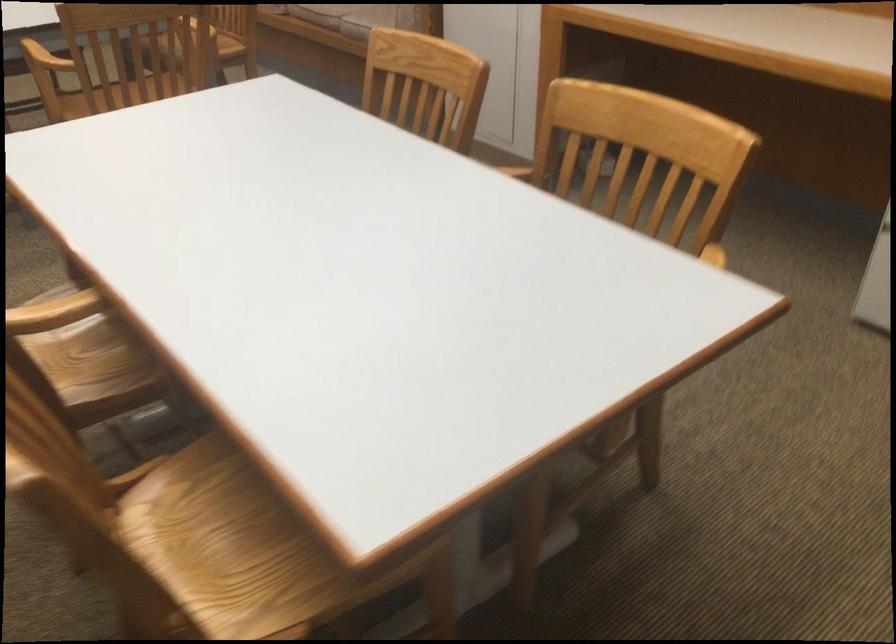
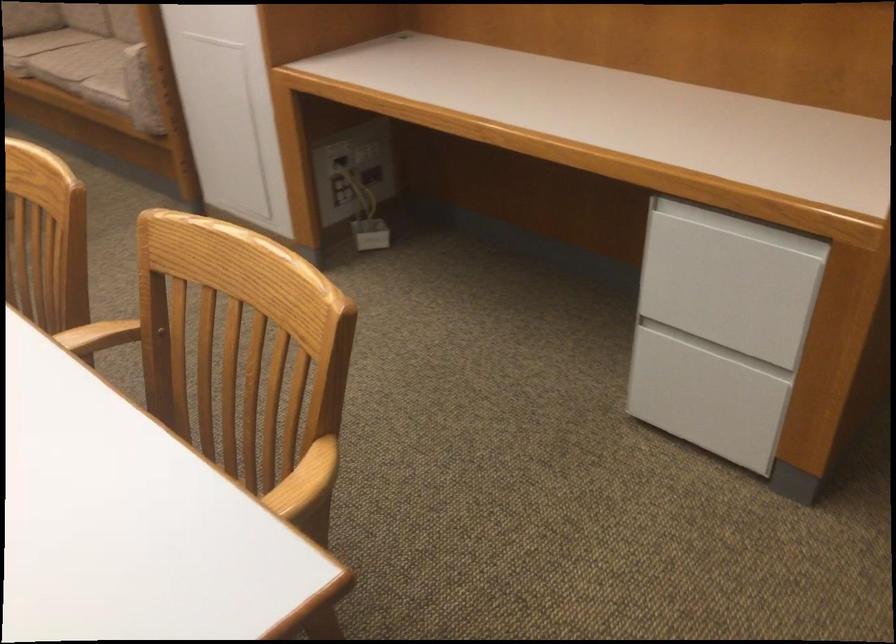
Question: The camera is either moving clockwise (left) or counter-clockwise (right) around the object. The first image is from the beginning of the video and the second image is from the end. Is the camera moving left or right when shooting the video?

Choices:
 (A) Left
 (B) Right

Answer: (A)